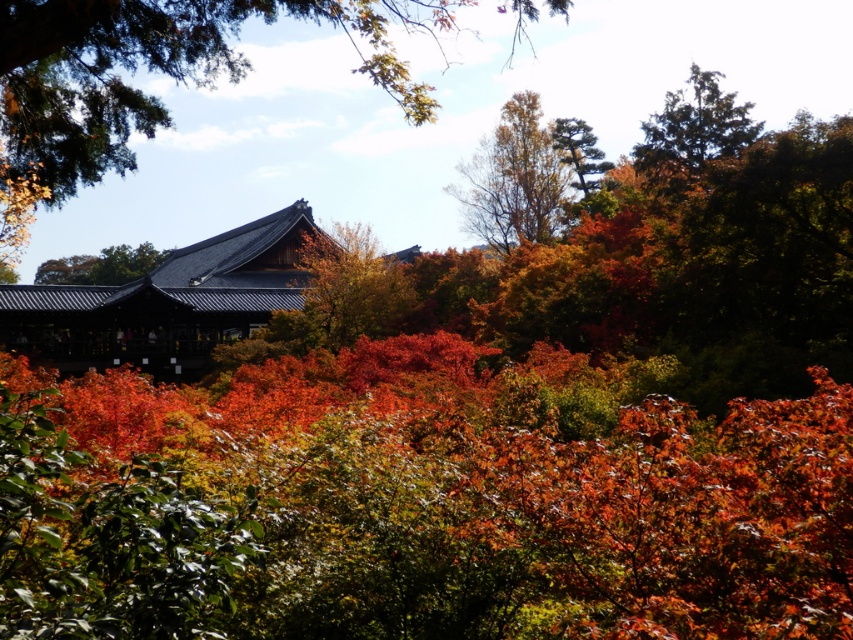
Question: Which object is the closest to the brown textured tree at upper center?

Choices:
 (A) smooth brown tree trunk at center
 (B) green textured tree at upper right
 (C) green textured pine tree at upper center

Answer: (C)

Question: Which point is farther to the camera?

Choices:
 (A) brown textured tree at upper center
 (B) shiny dark brown roof at upper center
 (C) green textured tree at upper right

Answer: (B)

Question: Does brown textured tree at upper center come behind shiny dark brown roof at upper center?

Choices:
 (A) yes
 (B) no

Answer: (B)

Question: Is smooth brown tree trunk at center positioned before shiny dark brown roof at upper center?

Choices:
 (A) no
 (B) yes

Answer: (B)

Question: Which object appears closest to the camera in this image?

Choices:
 (A) green textured pine tree at upper center
 (B) smooth brown tree trunk at center

Answer: (B)

Question: Where is shiny dark brown roof at upper center located in relation to green textured pine tree at upper center in the image?

Choices:
 (A) right
 (B) left

Answer: (B)